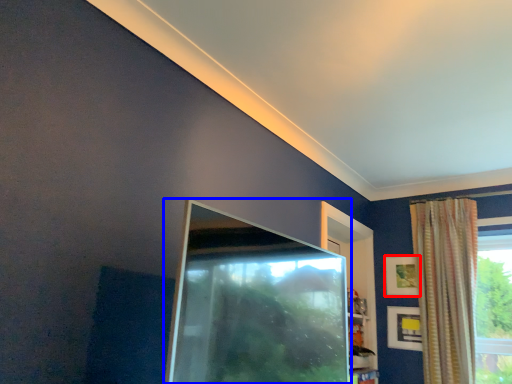
Question: Which object appears farthest to the camera in this image, picture frame (highlighted by a red box) or screen door (highlighted by a blue box)?

Choices:
 (A) picture frame
 (B) screen door

Answer: (A)